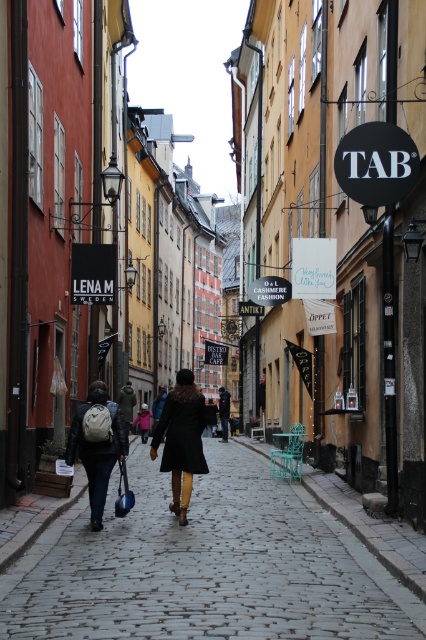
In the scene shown: Does gray cobblestone pavement at center have a greater width compared to matte black coat at center?

Yes.

Can you confirm if gray cobblestone pavement at center is positioned above matte black coat at center?

Actually, gray cobblestone pavement at center is below matte black coat at center.

Does point (149, 557) come closer to viewer compared to point (169, 465)?

Yes, point (149, 557) is closer to viewer.

In order to click on gray cobblestone pavement at center in this screenshot , I will do `click(206, 566)`.

Between point (261, 611) and point (98, 490), which one is positioned behind?

The point (98, 490) is more distant.

Between gray cobblestone pavement at center and matte black backpack at center, which one has more height?

Standing taller between the two is matte black backpack at center.

Which is behind, point (215, 532) or point (71, 456)?

Point (71, 456)

This screenshot has height=640, width=426. Find the location of `gray cobblestone pavement at center`. gray cobblestone pavement at center is located at coordinates (206, 566).

Measure the distance between point [189,472] and camera.

Point [189,472] and camera are 11.92 meters apart.

Image resolution: width=426 pixels, height=640 pixels. I want to click on matte black coat at center, so click(181, 438).

I want to click on matte black coat at center, so click(x=181, y=438).